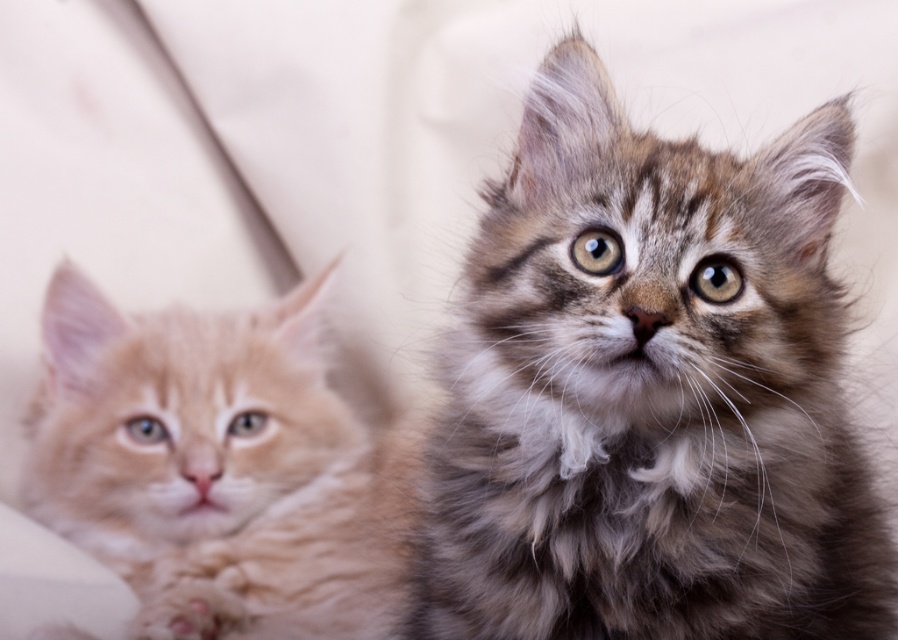
Question: Which of the following is the closest to the observer?

Choices:
 (A) (102, 294)
 (B) (799, 316)

Answer: (B)

Question: Is fuzzy gray tabby kitten at center thinner than orange tabby kitten at left?

Choices:
 (A) no
 (B) yes

Answer: (A)

Question: In this image, where is fuzzy gray tabby kitten at center located relative to orange tabby kitten at left?

Choices:
 (A) above
 (B) below

Answer: (A)

Question: Which point appears farthest from the camera in this image?

Choices:
 (A) (546, 257)
 (B) (174, 397)

Answer: (B)

Question: Among these objects, which one is farthest from the camera?

Choices:
 (A) orange tabby kitten at left
 (B) fuzzy gray tabby kitten at center

Answer: (A)

Question: Where is fuzzy gray tabby kitten at center located in relation to orange tabby kitten at left in the image?

Choices:
 (A) below
 (B) above

Answer: (B)